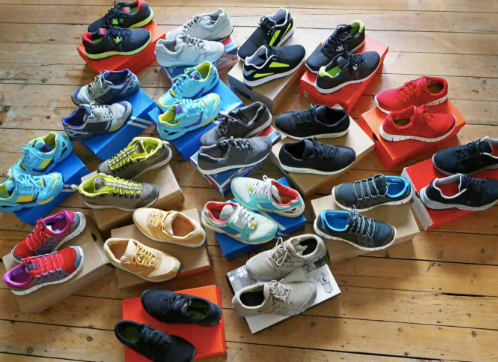
Locate an element on the screen. Image resolution: width=498 pixels, height=362 pixels. pairs of shoes on a box with some blue is located at coordinates (276, 218), (223, 140), (191, 107), (102, 112), (43, 174).